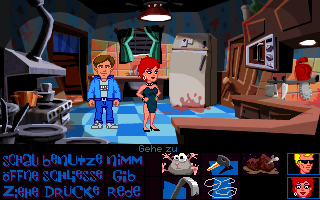
I want to click on stove top, so click(x=49, y=108).